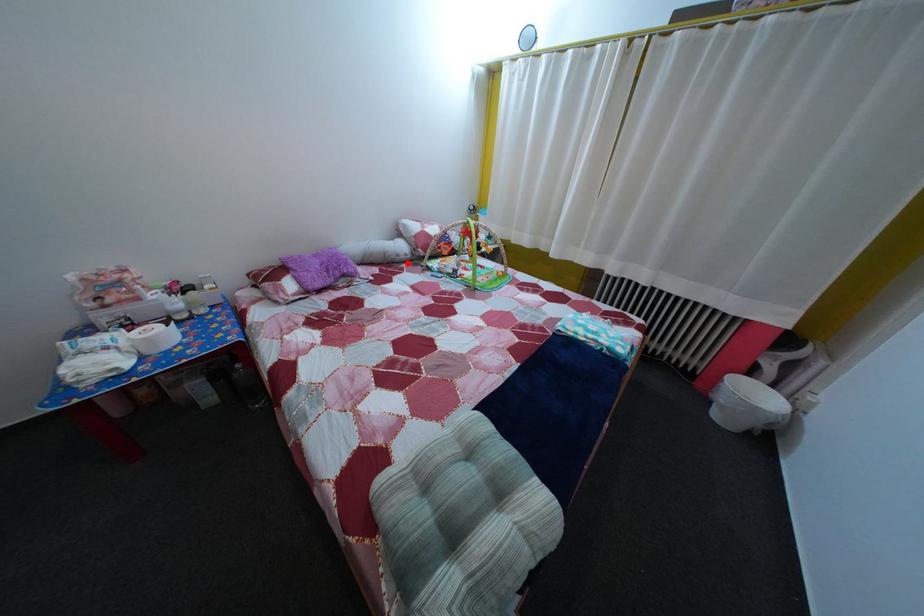
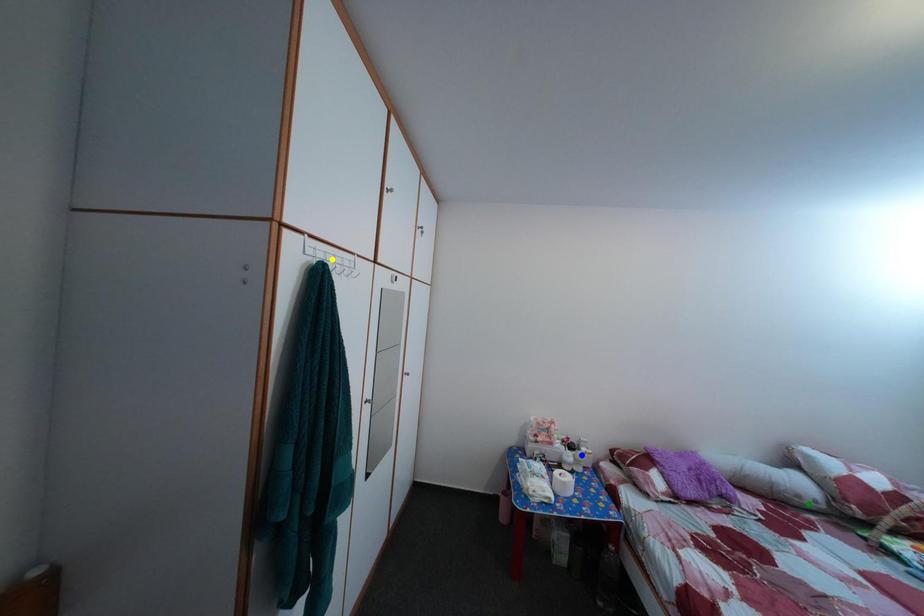
Question: I am providing you with two images of the same scene from different viewpoints. A red point is marked on the first image. You are given multiple points on the second image. Which point in image 2 represents the same 3d spot as the red point in image 1?

Choices:
 (A) yellow point
 (B) blue point
 (C) green point

Answer: (C)